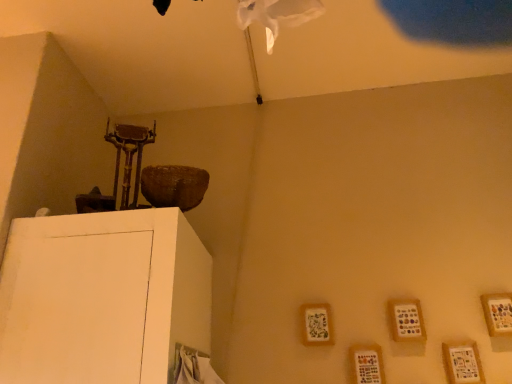
Image resolution: width=512 pixels, height=384 pixels. Find the location of `wooden frame at upper right, the 1th picture frame positioned from the right`. wooden frame at upper right, the 1th picture frame positioned from the right is located at coordinates pos(498,313).

What do you see at coordinates (406, 320) in the screenshot?
I see `wooden frame at lower right, which appears as the 3th picture frame when viewed from the right` at bounding box center [406, 320].

Identify the location of wooden frame at lower right, positioned as the third picture frame in left-to-right order. (406, 320).

Where is `wooden frame at lower right, arranged as the second picture frame when viewed from the right`? wooden frame at lower right, arranged as the second picture frame when viewed from the right is located at coordinates (462, 363).

Is wooden frame at lower right, which appears as the 3th picture frame when viewed from the right, not close to wooden frame at lower right, positioned as the 1th picture frame in left-to-right order?

wooden frame at lower right, which appears as the 3th picture frame when viewed from the right, is near wooden frame at lower right, positioned as the 1th picture frame in left-to-right order, not far away.

In the scene shown: Is wooden frame at lower right, which appears as the 3th picture frame when viewed from the right, completely or partially outside of wooden frame at lower right, positioned as the 1th picture frame in left-to-right order?

Indeed, wooden frame at lower right, which appears as the 3th picture frame when viewed from the right, is completely outside wooden frame at lower right, positioned as the 1th picture frame in left-to-right order.

Does wooden frame at lower right, positioned as the third picture frame in left-to-right order, appear on the left side of wooden frame at lower right, which appears as the 5th picture frame when viewed from the right?

In fact, wooden frame at lower right, positioned as the third picture frame in left-to-right order, is to the right of wooden frame at lower right, which appears as the 5th picture frame when viewed from the right.

Which of these two, wooden frame at lower right, which appears as the 3th picture frame when viewed from the right, or wooden frame at lower right, which appears as the 5th picture frame when viewed from the right, is smaller?

wooden frame at lower right, which appears as the 5th picture frame when viewed from the right, is smaller.

Can you confirm if wooden frame at lower right, positioned as the third picture frame in left-to-right order, is wider than wooden picture frame at lower right, positioned as the 2th picture frame in left-to-right order?

Yes.

Is point (406, 314) more distant than point (376, 366)?

That is True.

Consider the image. From a real-world perspective, is wooden frame at lower right, which appears as the 3th picture frame when viewed from the right, on wooden picture frame at lower right, arranged as the fourth picture frame when viewed from the right?

Yes, from a real-world perspective, wooden frame at lower right, which appears as the 3th picture frame when viewed from the right, is above wooden picture frame at lower right, arranged as the fourth picture frame when viewed from the right.

From a real-world perspective, is wooden frame at lower right, which appears as the 5th picture frame when viewed from the right, located beneath wooden frame at lower right, which appears as the 3th picture frame when viewed from the right?

No, from a real-world perspective, wooden frame at lower right, which appears as the 5th picture frame when viewed from the right, is not under wooden frame at lower right, which appears as the 3th picture frame when viewed from the right.

Between wooden frame at lower right, positioned as the 1th picture frame in left-to-right order, and wooden frame at lower right, which appears as the 3th picture frame when viewed from the right, which one has smaller width?

wooden frame at lower right, positioned as the 1th picture frame in left-to-right order, is thinner.

Consider the image. How different are the orientations of wooden frame at lower right, positioned as the 1th picture frame in left-to-right order, and wooden frame at lower right, positioned as the third picture frame in left-to-right order, in degrees?

0.00341 degrees separate the facing orientations of wooden frame at lower right, positioned as the 1th picture frame in left-to-right order, and wooden frame at lower right, positioned as the third picture frame in left-to-right order.

From the image's perspective, is wooden frame at lower right, which appears as the 5th picture frame when viewed from the right, under wooden picture frame at lower right, positioned as the 2th picture frame in left-to-right order?

No, from the image's perspective, wooden frame at lower right, which appears as the 5th picture frame when viewed from the right, is not below wooden picture frame at lower right, positioned as the 2th picture frame in left-to-right order.

Is wooden frame at lower right, which appears as the 5th picture frame when viewed from the right, positioned with its back to wooden picture frame at lower right, positioned as the 2th picture frame in left-to-right order?

No, wooden frame at lower right, which appears as the 5th picture frame when viewed from the right, is not facing away from wooden picture frame at lower right, positioned as the 2th picture frame in left-to-right order.

In terms of height, does wooden frame at lower right, positioned as the 1th picture frame in left-to-right order, look taller or shorter compared to wooden picture frame at lower right, positioned as the 2th picture frame in left-to-right order?

wooden frame at lower right, positioned as the 1th picture frame in left-to-right order, is shorter than wooden picture frame at lower right, positioned as the 2th picture frame in left-to-right order.

From the image's perspective, does wooden picture frame at lower right, arranged as the fourth picture frame when viewed from the right, appear lower than wooden frame at lower right, which is the 4th picture frame from left to right?

Yes.

Consider the image. Is wooden picture frame at lower right, positioned as the 2th picture frame in left-to-right order, facing away from wooden frame at lower right, arranged as the second picture frame when viewed from the right?

That's not correct — wooden picture frame at lower right, positioned as the 2th picture frame in left-to-right order, is not looking away from wooden frame at lower right, arranged as the second picture frame when viewed from the right.

Can we say wooden picture frame at lower right, arranged as the fourth picture frame when viewed from the right, lies outside wooden frame at lower right, arranged as the second picture frame when viewed from the right?

Yes, wooden picture frame at lower right, arranged as the fourth picture frame when viewed from the right, is outside of wooden frame at lower right, arranged as the second picture frame when viewed from the right.

I want to click on picture frame that is the 1st one above the wooden picture frame at lower right, arranged as the fourth picture frame when viewed from the right (from a real-world perspective), so click(462, 363).

Is wooden frame at lower right, arranged as the second picture frame when viewed from the right, next to wooden picture frame at lower right, positioned as the 2th picture frame in left-to-right order?

No, wooden frame at lower right, arranged as the second picture frame when viewed from the right, is not beside wooden picture frame at lower right, positioned as the 2th picture frame in left-to-right order.

In terms of width, does wooden frame at lower right, arranged as the second picture frame when viewed from the right, look wider or thinner when compared to wooden picture frame at lower right, positioned as the 2th picture frame in left-to-right order?

Considering their sizes, wooden frame at lower right, arranged as the second picture frame when viewed from the right, looks broader than wooden picture frame at lower right, positioned as the 2th picture frame in left-to-right order.

From the image's perspective, is wooden frame at lower right, arranged as the second picture frame when viewed from the right, above or below wooden picture frame at lower right, arranged as the fourth picture frame when viewed from the right?

Based on their image positions, wooden frame at lower right, arranged as the second picture frame when viewed from the right, is located above wooden picture frame at lower right, arranged as the fourth picture frame when viewed from the right.

Which is closer to the camera, (325, 306) or (500, 319)?

Point (325, 306).

Are wooden frame at lower right, positioned as the 1th picture frame in left-to-right order, and wooden frame at upper right, the 1th picture frame positioned from the right, located far from each other?

No, wooden frame at lower right, positioned as the 1th picture frame in left-to-right order, is in close proximity to wooden frame at upper right, the 1th picture frame positioned from the right.

Relative to wooden frame at upper right, the 1th picture frame positioned from the right, is wooden frame at lower right, which appears as the 5th picture frame when viewed from the right, in front or behind?

Visually, wooden frame at lower right, which appears as the 5th picture frame when viewed from the right, is located behind wooden frame at upper right, the 1th picture frame positioned from the right.

Would you say wooden frame at lower right, which appears as the 5th picture frame when viewed from the right, contains wooden frame at upper right, the 1th picture frame positioned from the right?

No, wooden frame at upper right, the 1th picture frame positioned from the right, is not surrounded by wooden frame at lower right, which appears as the 5th picture frame when viewed from the right.

Image resolution: width=512 pixels, height=384 pixels. In order to click on picture frame that is behind the wooden frame at lower right, positioned as the third picture frame in left-to-right order in this screenshot , I will do `click(317, 324)`.

The image size is (512, 384). Identify the location of picture frame that is the 2nd one when counting forward from the wooden frame at lower right, which appears as the 3th picture frame when viewed from the right. (367, 364).

In the scene shown: When comparing their distances from wooden frame at lower right, which appears as the 5th picture frame when viewed from the right, does wooden frame at lower right, which appears as the 3th picture frame when viewed from the right, or wooden frame at upper right, acting as the fifth picture frame starting from the left, seem further?

Based on the image, wooden frame at upper right, acting as the fifth picture frame starting from the left, appears to be further to wooden frame at lower right, which appears as the 5th picture frame when viewed from the right.

Considering their positions, is wooden picture frame at lower right, positioned as the 2th picture frame in left-to-right order, positioned closer to wooden frame at lower right, positioned as the 1th picture frame in left-to-right order, than wooden frame at lower right, positioned as the third picture frame in left-to-right order?

wooden picture frame at lower right, positioned as the 2th picture frame in left-to-right order, is closer to wooden frame at lower right, positioned as the 1th picture frame in left-to-right order.

Looking at the image, which one is located closer to wooden frame at upper right, the 1th picture frame positioned from the right, wooden frame at lower right, which appears as the 5th picture frame when viewed from the right, or wooden frame at lower right, which appears as the 3th picture frame when viewed from the right?

wooden frame at lower right, which appears as the 3th picture frame when viewed from the right, is positioned closer to the anchor wooden frame at upper right, the 1th picture frame positioned from the right.

Looking at the image, which one is located further to wooden frame at upper right, the 1th picture frame positioned from the right, wooden frame at lower right, positioned as the third picture frame in left-to-right order, or wooden frame at lower right, which is the 4th picture frame from left to right?

The object further to wooden frame at upper right, the 1th picture frame positioned from the right, is wooden frame at lower right, positioned as the third picture frame in left-to-right order.

Based on their spatial positions, is wooden frame at upper right, the 1th picture frame positioned from the right, or wooden picture frame at lower right, arranged as the fourth picture frame when viewed from the right, further from wooden frame at lower right, arranged as the second picture frame when viewed from the right?

wooden picture frame at lower right, arranged as the fourth picture frame when viewed from the right, lies further to wooden frame at lower right, arranged as the second picture frame when viewed from the right, than the other object.

Based on their spatial positions, is wooden frame at upper right, the 1th picture frame positioned from the right, or wooden picture frame at lower right, arranged as the fourth picture frame when viewed from the right, closer to wooden frame at lower right, which appears as the 5th picture frame when viewed from the right?

Based on the image, wooden picture frame at lower right, arranged as the fourth picture frame when viewed from the right, appears to be nearer to wooden frame at lower right, which appears as the 5th picture frame when viewed from the right.

Looking at the image, which one is located closer to wooden frame at lower right, positioned as the 1th picture frame in left-to-right order, wooden frame at upper right, acting as the fifth picture frame starting from the left, or wooden frame at lower right, arranged as the second picture frame when viewed from the right?

Based on the image, wooden frame at lower right, arranged as the second picture frame when viewed from the right, appears to be nearer to wooden frame at lower right, positioned as the 1th picture frame in left-to-right order.

When comparing their distances from wooden frame at lower right, which appears as the 5th picture frame when viewed from the right, does wooden picture frame at lower right, arranged as the fourth picture frame when viewed from the right, or wooden frame at upper right, acting as the fifth picture frame starting from the left, seem closer?

wooden picture frame at lower right, arranged as the fourth picture frame when viewed from the right, is closer to wooden frame at lower right, which appears as the 5th picture frame when viewed from the right.

Where is `picture frame between wooden frame at lower right, positioned as the third picture frame in left-to-right order, and wooden frame at upper right, acting as the fifth picture frame starting from the left`? picture frame between wooden frame at lower right, positioned as the third picture frame in left-to-right order, and wooden frame at upper right, acting as the fifth picture frame starting from the left is located at coordinates (462, 363).

Locate an element on the screen. picture frame between wooden picture frame at lower right, arranged as the fourth picture frame when viewed from the right, and wooden frame at lower right, arranged as the second picture frame when viewed from the right is located at coordinates (406, 320).

Identify the location of picture frame between wooden frame at lower right, positioned as the 1th picture frame in left-to-right order, and wooden frame at lower right, which appears as the 3th picture frame when viewed from the right, from left to right. (367, 364).